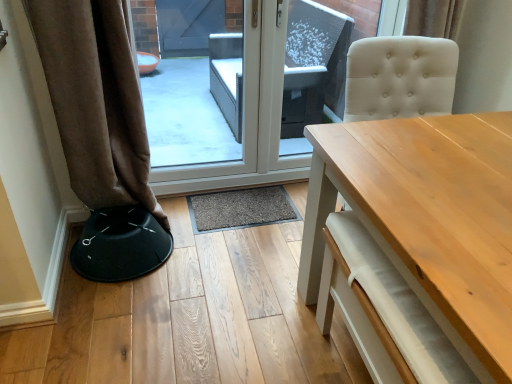
Question: Is transparent glass door at center further to camera compared to black fabric bar stool at lower left?

Choices:
 (A) yes
 (B) no

Answer: (A)

Question: Are transparent glass door at center and black fabric bar stool at lower left located far from each other?

Choices:
 (A) no
 (B) yes

Answer: (A)

Question: Is transparent glass door at center positioned before black fabric bar stool at lower left?

Choices:
 (A) no
 (B) yes

Answer: (A)

Question: Is transparent glass door at center smaller than black fabric bar stool at lower left?

Choices:
 (A) yes
 (B) no

Answer: (B)

Question: Is black fabric bar stool at lower left at the back of transparent glass door at center?

Choices:
 (A) no
 (B) yes

Answer: (A)

Question: From a real-world perspective, is transparent glass door at center over black fabric bar stool at lower left?

Choices:
 (A) yes
 (B) no

Answer: (A)

Question: Does black fabric bar stool at lower left turn towards light wood table at center?

Choices:
 (A) no
 (B) yes

Answer: (A)

Question: Is the depth of black fabric bar stool at lower left greater than that of light wood table at center?

Choices:
 (A) no
 (B) yes

Answer: (B)

Question: Is black fabric bar stool at lower left beside light wood table at center?

Choices:
 (A) no
 (B) yes

Answer: (A)

Question: Does black fabric bar stool at lower left have a lesser height compared to light wood table at center?

Choices:
 (A) yes
 (B) no

Answer: (A)

Question: Does black fabric bar stool at lower left have a greater width compared to light wood table at center?

Choices:
 (A) no
 (B) yes

Answer: (A)

Question: From a real-world perspective, is black fabric bar stool at lower left positioned over light wood table at center based on gravity?

Choices:
 (A) yes
 (B) no

Answer: (B)

Question: Does light wood table at center appear on the right side of transparent glass door at center?

Choices:
 (A) yes
 (B) no

Answer: (A)